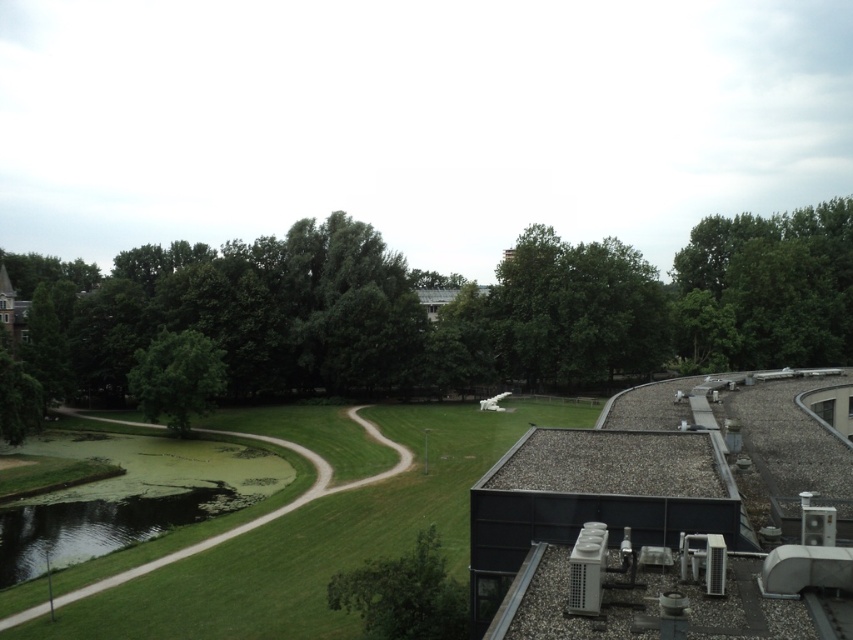
You are a bird flying over the scene and want to land on the tallest object between the green leafy tree at center and the green mossy pond at lower left. Which one should you choose?

The green leafy tree at center has a greater height compared to the green mossy pond at lower left, so you should choose the green leafy tree at center to land on.

You are standing on the roof and want to plant a new tree exactly at the point marked as point (456, 308). According to the image, is there already a tree at that location?

Yes, there is already a green leafy tree at center located at point (456, 308).

You are standing at the point with coordinates point (846, 305) and want to walk towards the point with coordinates point (779, 355). Based on the scene description, will you be walking towards or away from the grassy area?

Point (779, 355) is in front of point (846, 305), so walking towards point (779, 355) means you are moving towards the grassy area.